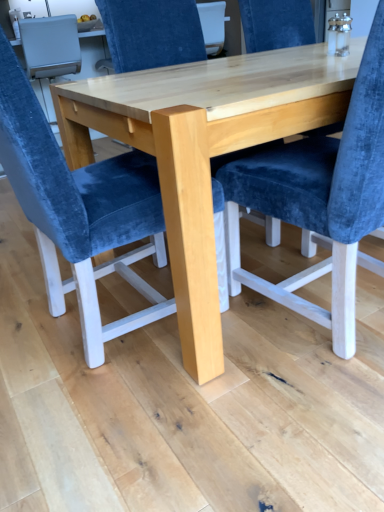
The height and width of the screenshot is (512, 384). What do you see at coordinates (152, 33) in the screenshot? I see `velvet blue chair at center, the second chair viewed from the front` at bounding box center [152, 33].

Consider the image. What is the approximate height of velvet blue chair at center, the 1th chair in the back-to-front sequence?

velvet blue chair at center, the 1th chair in the back-to-front sequence, is 3.38 feet tall.

This screenshot has width=384, height=512. Identify the location of natural wood table at center. (204, 149).

Find the location of a particular element. The width and height of the screenshot is (384, 512). velvet blue chair at center, the 1th chair in the back-to-front sequence is located at coordinates (152, 33).

Is velvet blue chair at center, the 1th chair in the back-to-front sequence, positioned far away from velvet blue chair at center, placed as the first chair when sorted from front to back?

That's not correct — velvet blue chair at center, the 1th chair in the back-to-front sequence, is a little close to velvet blue chair at center, placed as the first chair when sorted from front to back.

Is point (180, 54) closer to camera compared to point (153, 253)?

That is False.

From the image's perspective, relative to velvet blue chair at center, placed as the first chair when sorted from front to back, is velvet blue chair at center, the 1th chair in the back-to-front sequence, above or below?

velvet blue chair at center, the 1th chair in the back-to-front sequence, is above velvet blue chair at center, placed as the first chair when sorted from front to back.

Is velvet blue chair at center, the 1th chair in the back-to-front sequence, bigger than velvet blue chair at center, placed as the first chair when sorted from front to back?

Yes, velvet blue chair at center, the 1th chair in the back-to-front sequence, is bigger than velvet blue chair at center, placed as the first chair when sorted from front to back.

Is point (35, 228) less distant than point (180, 302)?

No, (35, 228) is further to viewer.

From a real-world perspective, who is located lower, velvet blue chair at center, placed as the first chair when sorted from front to back, or natural wood table at center?

From a 3D spatial view, natural wood table at center is below.

Are velvet blue chair at center, placed as the first chair when sorted from front to back, and natural wood table at center located far from each other?

That's not correct — velvet blue chair at center, placed as the first chair when sorted from front to back, is a little close to natural wood table at center.

Could you tell me if velvet blue chair at center, placed as the first chair when sorted from front to back, is facing natural wood table at center?

Yes, velvet blue chair at center, placed as the first chair when sorted from front to back, is aimed at natural wood table at center.

Which is correct: velvet blue chair at center, the 2th chair viewed from the back, is inside velvet blue chair at center, the 1th chair in the back-to-front sequence, or outside of it?

velvet blue chair at center, the 2th chair viewed from the back, cannot be found inside velvet blue chair at center, the 1th chair in the back-to-front sequence.

Could you measure the distance between velvet blue chair at center, the 2th chair viewed from the back, and velvet blue chair at center, the 1th chair in the back-to-front sequence?

velvet blue chair at center, the 2th chair viewed from the back, and velvet blue chair at center, the 1th chair in the back-to-front sequence, are 33.06 inches apart.

From a real-world perspective, is velvet blue chair at center, placed as the first chair when sorted from front to back, physically located above or below velvet blue chair at center, the second chair viewed from the front?

Clearly, from a real-world perspective, velvet blue chair at center, placed as the first chair when sorted from front to back, is below velvet blue chair at center, the second chair viewed from the front.

Is velvet blue chair at center, the 1th chair in the back-to-front sequence, at the back of velvet blue chair at center, the 2th chair viewed from the back?

No, velvet blue chair at center, the 2th chair viewed from the back, is not facing the opposite direction of velvet blue chair at center, the 1th chair in the back-to-front sequence.

Choose the correct answer: Is velvet blue chair at center, the 1th chair in the back-to-front sequence, inside natural wood table at center or outside it?

velvet blue chair at center, the 1th chair in the back-to-front sequence, is contained in natural wood table at center.

From a real-world perspective, is velvet blue chair at center, the 1th chair in the back-to-front sequence, positioned under natural wood table at center based on gravity?

No.

Relative to natural wood table at center, is velvet blue chair at center, the second chair viewed from the front, in front or behind?

In the image, velvet blue chair at center, the second chair viewed from the front, appears behind natural wood table at center.

Consider the image. Which point is more forward, (188, 0) or (353, 78)?

Point (353, 78)

Can velvet blue chair at center, the 1th chair in the back-to-front sequence, be found inside natural wood table at center?

Yes, velvet blue chair at center, the 1th chair in the back-to-front sequence, is a part of natural wood table at center.

From a real-world perspective, which is physically below, natural wood table at center or velvet blue chair at center, the 1th chair in the back-to-front sequence?

In real-world perspective, natural wood table at center is lower.

Considering the points (87, 153) and (116, 21), which point is behind, point (87, 153) or point (116, 21)?

The point (116, 21) is more distant.

Between natural wood table at center and velvet blue chair at center, the 1th chair in the back-to-front sequence, which one appears on the right side from the viewer's perspective?

natural wood table at center is more to the right.

Which of these two, natural wood table at center or velvet blue chair at center, placed as the first chair when sorted from front to back, is thinner?

With smaller width is velvet blue chair at center, placed as the first chair when sorted from front to back.

From the image's perspective, is natural wood table at center below velvet blue chair at center, placed as the first chair when sorted from front to back?

Actually, natural wood table at center appears above velvet blue chair at center, placed as the first chair when sorted from front to back, in the image.

How many degrees apart are the facing directions of natural wood table at center and velvet blue chair at center, placed as the first chair when sorted from front to back?

86.7 degrees separate the facing orientations of natural wood table at center and velvet blue chair at center, placed as the first chair when sorted from front to back.

Is natural wood table at center at the left side of velvet blue chair at center, placed as the first chair when sorted from front to back?

Incorrect, natural wood table at center is not on the left side of velvet blue chair at center, placed as the first chair when sorted from front to back.

Locate an element on the screen. This screenshot has width=384, height=512. chair that is on the right side of velvet blue chair at center, placed as the first chair when sorted from front to back is located at coordinates (152, 33).

Locate an element on the screen. The width and height of the screenshot is (384, 512). table behind the velvet blue chair at center, placed as the first chair when sorted from front to back is located at coordinates (204, 149).

Which object lies nearer to the anchor point velvet blue chair at center, the second chair viewed from the front, velvet blue chair at center, the 2th chair viewed from the back, or natural wood table at center?

Among the two, natural wood table at center is located nearer to velvet blue chair at center, the second chair viewed from the front.

When comparing their distances from velvet blue chair at center, the second chair viewed from the front, does natural wood table at center or velvet blue chair at center, placed as the first chair when sorted from front to back, seem closer?

natural wood table at center.

Considering their positions, is velvet blue chair at center, the second chair viewed from the front, positioned further to natural wood table at center than velvet blue chair at center, the 2th chair viewed from the back?

Based on the image, velvet blue chair at center, the second chair viewed from the front, appears to be further to natural wood table at center.

Which object lies further to the anchor point velvet blue chair at center, the 2th chair viewed from the back, velvet blue chair at center, the 1th chair in the back-to-front sequence, or natural wood table at center?

Among the two, velvet blue chair at center, the 1th chair in the back-to-front sequence, is located further to velvet blue chair at center, the 2th chair viewed from the back.

Estimate the real-world distances between objects in this image. Which object is closer to velvet blue chair at center, the 2th chair viewed from the back, natural wood table at center or velvet blue chair at center, the 1th chair in the back-to-front sequence?

natural wood table at center.

When comparing their distances from natural wood table at center, does velvet blue chair at center, the 2th chair viewed from the back, or velvet blue chair at center, the 1th chair in the back-to-front sequence, seem closer?

The object closer to natural wood table at center is velvet blue chair at center, the 2th chair viewed from the back.

At what (x,y) coordinates should I click in order to perform the action: click on chair between velvet blue chair at center, the 2th chair viewed from the back, and natural wood table at center, in the horizontal direction. Please return your answer as a coordinate pair (x, y). This screenshot has width=384, height=512. Looking at the image, I should click on (152, 33).